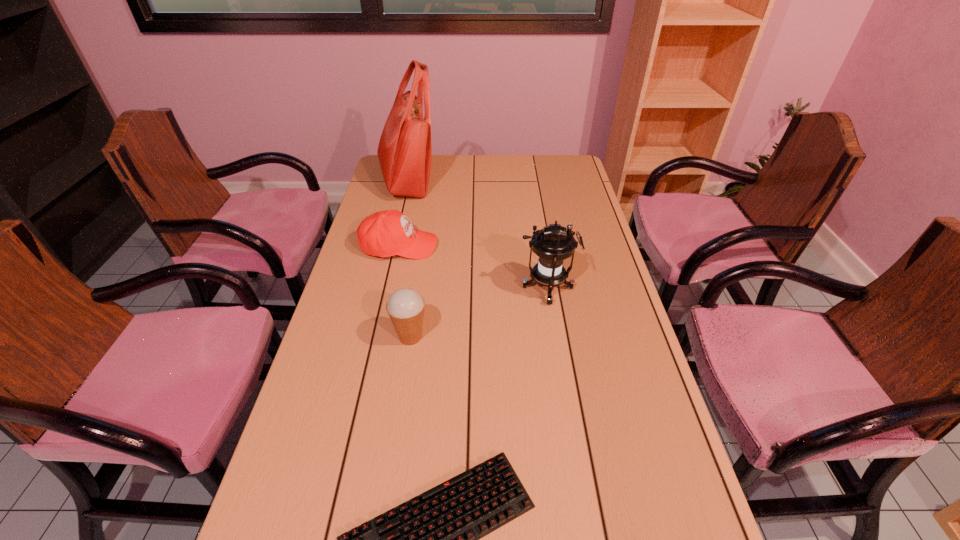
Find the location of `vacant space that satisfies the following two spatial constraints: 1. on the back side of the lantern; 2. on the front-facing side of the farthest object`. vacant space that satisfies the following two spatial constraints: 1. on the back side of the lantern; 2. on the front-facing side of the farthest object is located at coordinates 529,181.

In order to click on vacant point that satisfies the following two spatial constraints: 1. on the front panel of the icecream; 2. on the left side of the fourth tallest object in this screenshot , I will do `click(379, 337)`.

In order to click on vacant area in the image that satisfies the following two spatial constraints: 1. on the front panel of the fourth farthest object; 2. on the right side of the baseball cap in this screenshot , I will do `click(379, 337)`.

At what (x,y) coordinates should I click in order to perform the action: click on free location that satisfies the following two spatial constraints: 1. on the front panel of the third shortest object; 2. on the left side of the fourth nearest object. Please return your answer as a coordinate pair (x, y). This screenshot has width=960, height=540. Looking at the image, I should click on (379, 337).